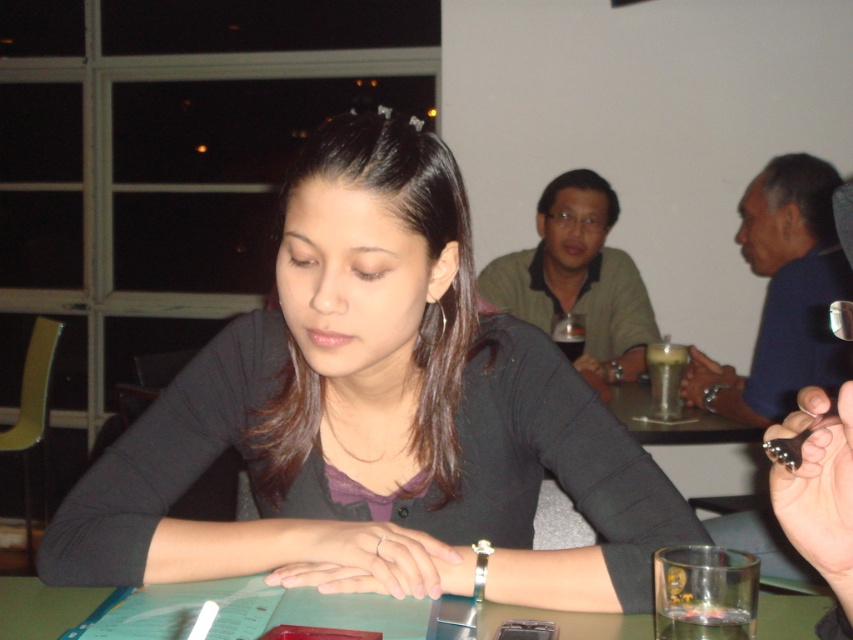
Question: Which point appears closest to the camera in this image?

Choices:
 (A) (364, 292)
 (B) (769, 600)

Answer: (A)

Question: Which of the following is the farthest from the observer?

Choices:
 (A) (498, 492)
 (B) (51, 593)

Answer: (A)

Question: Is matte black shirt at center above green matte table at center?

Choices:
 (A) no
 (B) yes

Answer: (B)

Question: Is matte black shirt at center wider than green matte table at center?

Choices:
 (A) yes
 (B) no

Answer: (A)

Question: Which object is farther from the camera taking this photo?

Choices:
 (A) green matte table at center
 (B) matte black shirt at center

Answer: (A)

Question: Can you confirm if matte black shirt at center is smaller than green matte table at center?

Choices:
 (A) yes
 (B) no

Answer: (B)